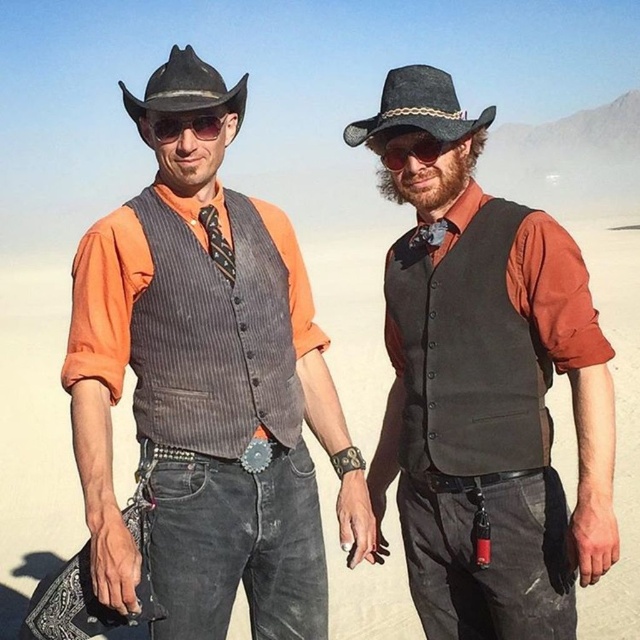
Question: Among these objects, which one is farthest from the camera?

Choices:
 (A) black felt cowboy hat at upper center
 (B) matte black sunglasses at upper center

Answer: (B)

Question: Is black wool vest at center positioned before black felt cowboy hat at upper left?

Choices:
 (A) no
 (B) yes

Answer: (B)

Question: Considering the real-world distances, which object is closest to the black felt cowboy hat at upper left?

Choices:
 (A) black wool vest at center
 (B) pinstriped wool vest at center
 (C) matte black goggles at center

Answer: (B)

Question: Is pinstriped wool vest at center smaller than matte black goggles at center?

Choices:
 (A) no
 (B) yes

Answer: (A)

Question: Estimate the real-world distances between objects in this image. Which object is farther from the matte black goggles at center?

Choices:
 (A) pinstriped wool vest at center
 (B) black wool vest at center
 (C) black felt cowboy hat at upper left
 (D) matte black sunglasses at upper center

Answer: (C)

Question: Can you confirm if matte black vest at center is smaller than pinstriped wool vest at center?

Choices:
 (A) yes
 (B) no

Answer: (A)